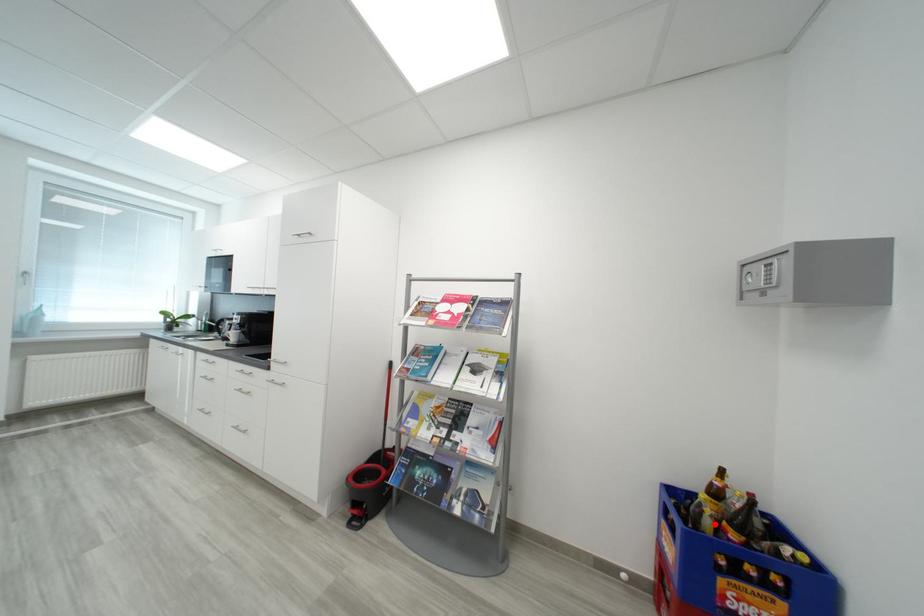
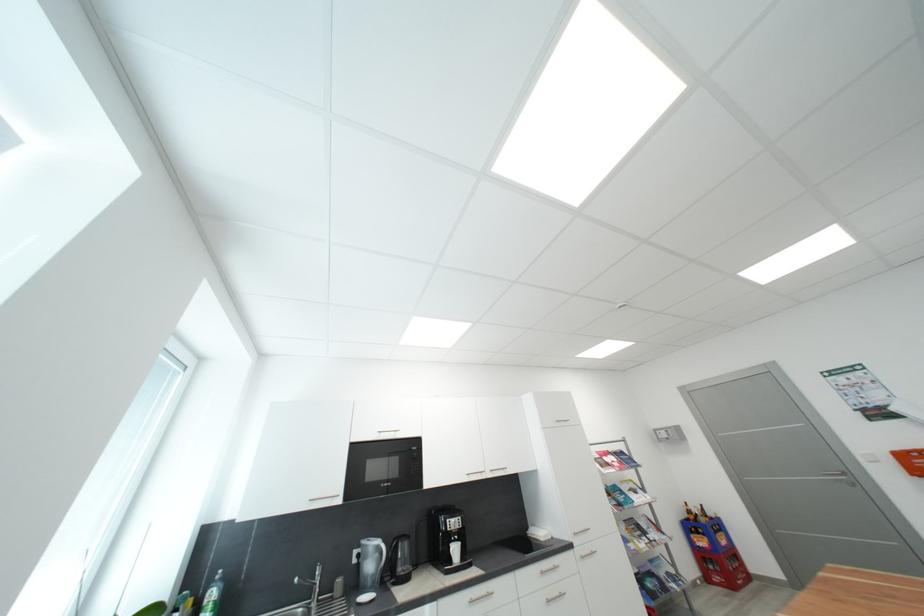
In the second image, find the point that corresponds to the highlighted location in the first image.

(710, 522)